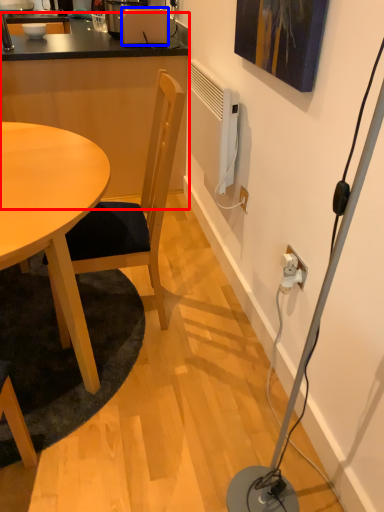
Question: Which object appears closest to the camera in this image, computer desk (highlighted by a red box) or toaster (highlighted by a blue box)?

Choices:
 (A) computer desk
 (B) toaster

Answer: (A)